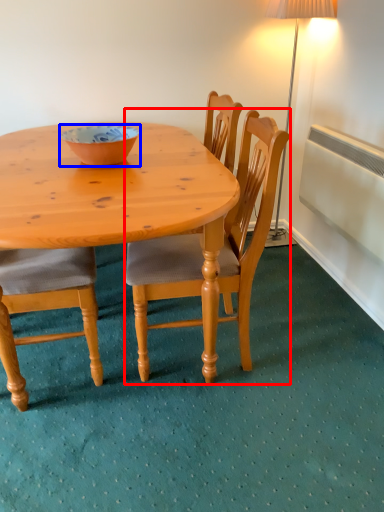
Question: Which point is further to the camera, chair (highlighted by a red box) or bowl (highlighted by a blue box)?

Choices:
 (A) chair
 (B) bowl

Answer: (B)